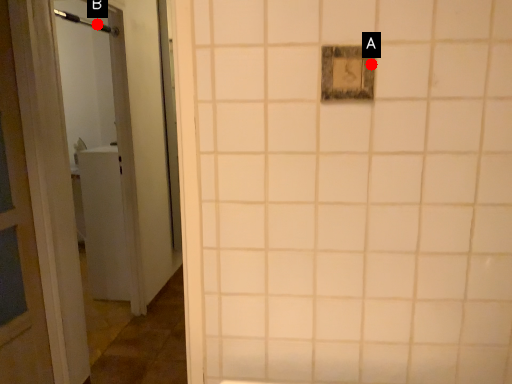
Question: Two points are circled on the image, labeled by A and B beside each circle. Which of the following is the closest to the observer?

Choices:
 (A) A is closer
 (B) B is closer

Answer: (A)